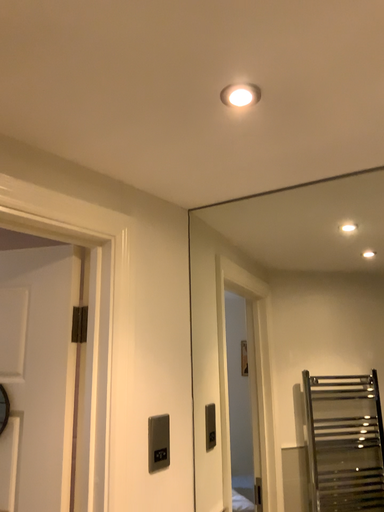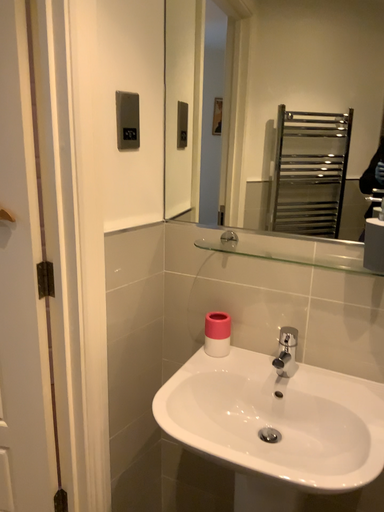
Question: Which way did the camera rotate in the video?

Choices:
 (A) rotated downward
 (B) rotated upward

Answer: (A)